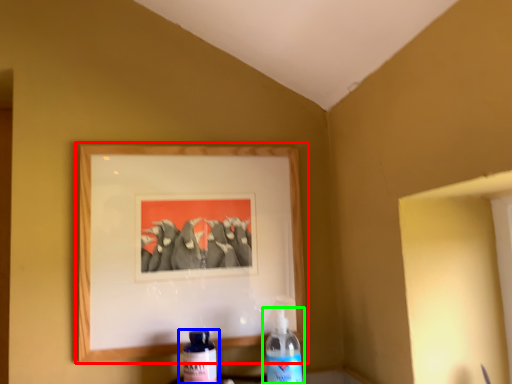
Question: Estimate the real-world distances between objects in this image. Which object is farther from picture frame (highlighted by a red box), bottle (highlighted by a blue box) or bottle (highlighted by a green box)?

Choices:
 (A) bottle
 (B) bottle

Answer: (A)